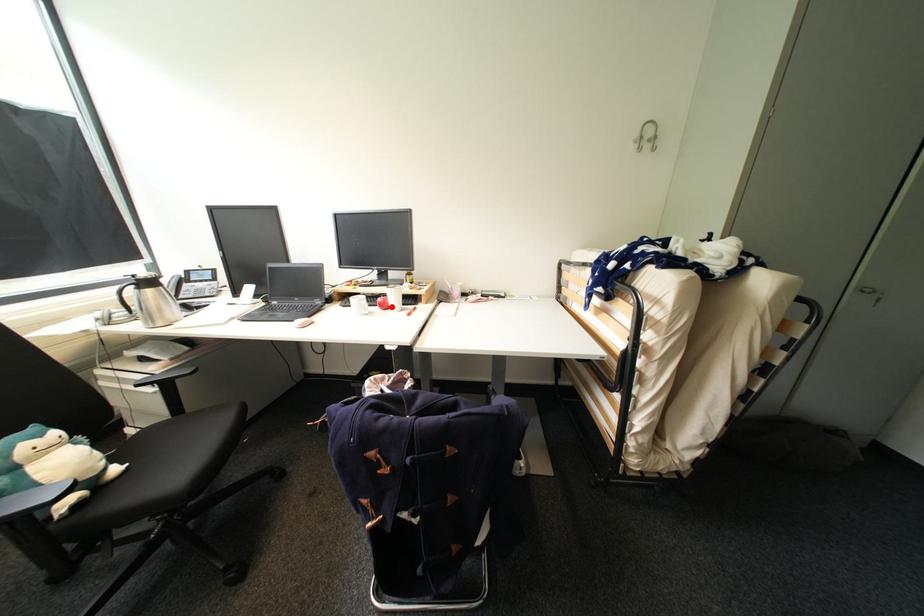
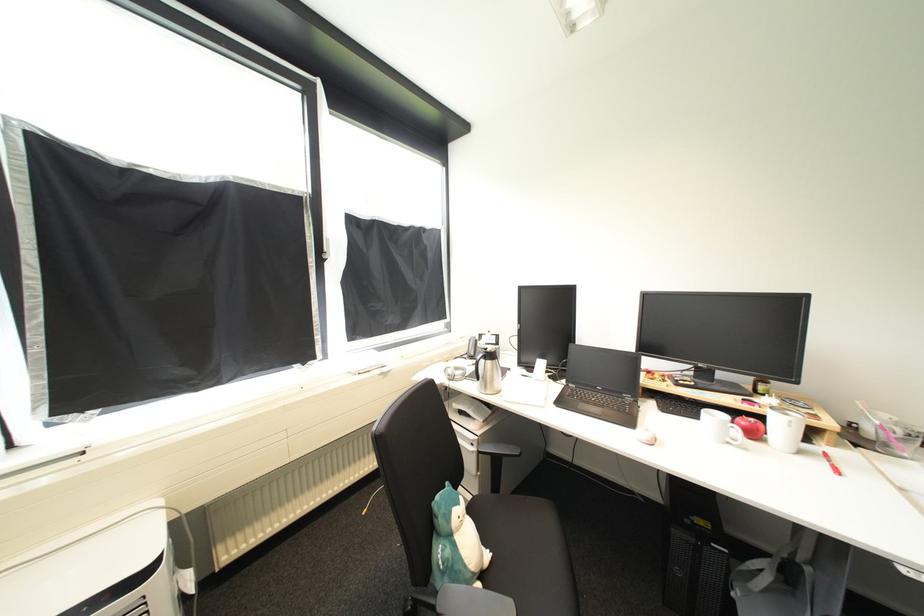
Where in the second image is the point corresponding to the highlighted location from the first image?

(761, 436)